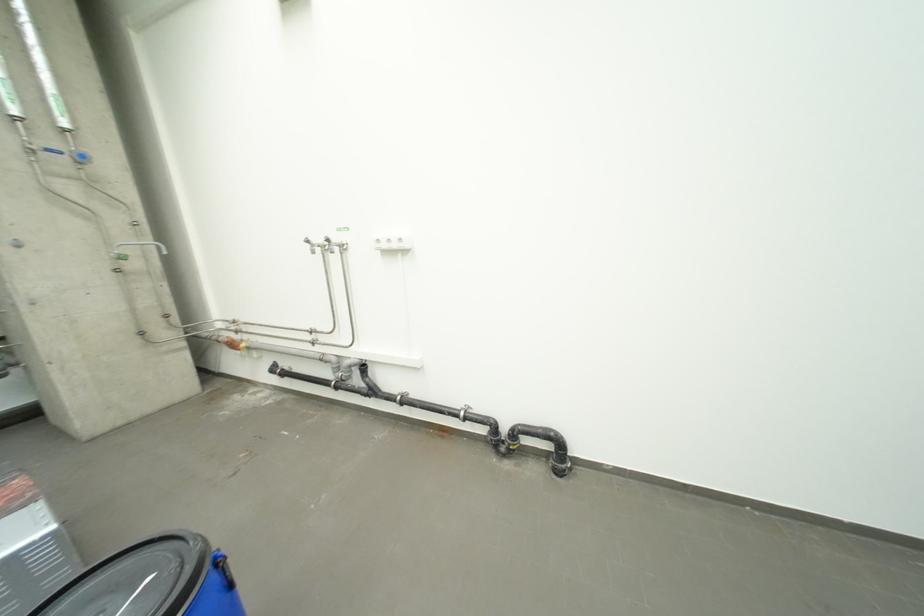
You are a GUI agent. You are given a task and a screenshot of the screen. Output one action in this format:
    pyautogui.click(x=<x>, y=<y>)
    Task: Click on the blue barrel handle
    The height and width of the screenshot is (616, 924).
    Given the screenshot: What is the action you would take?
    pyautogui.click(x=224, y=569)